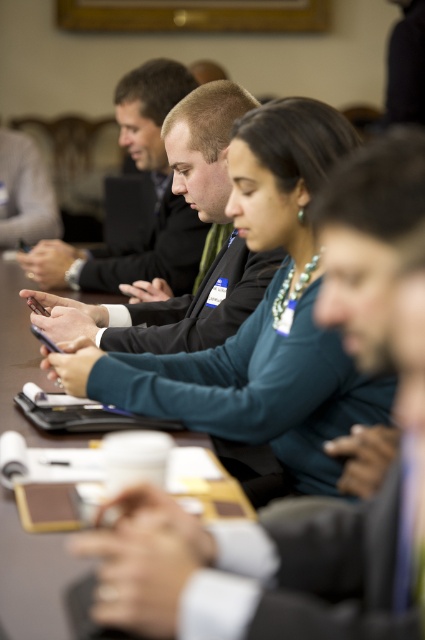
Question: Is teal fabric shirt at center smaller than matte black suit at center?

Choices:
 (A) yes
 (B) no

Answer: (A)

Question: Can you confirm if teal fabric shirt at center is wider than matte black suit at center?

Choices:
 (A) no
 (B) yes

Answer: (A)

Question: Which object appears farthest from the camera in this image?

Choices:
 (A) brown leather table at center
 (B) teal fabric shirt at center

Answer: (B)

Question: In this image, where is teal fabric shirt at center located relative to brown leather table at center?

Choices:
 (A) above
 (B) below

Answer: (A)

Question: Estimate the real-world distances between objects in this image. Which object is farther from the matte black suit at center?

Choices:
 (A) teal fabric shirt at center
 (B) brown leather table at center

Answer: (B)

Question: Which point is closer to the camera taking this photo?

Choices:
 (A) (348, 419)
 (B) (25, 426)

Answer: (A)